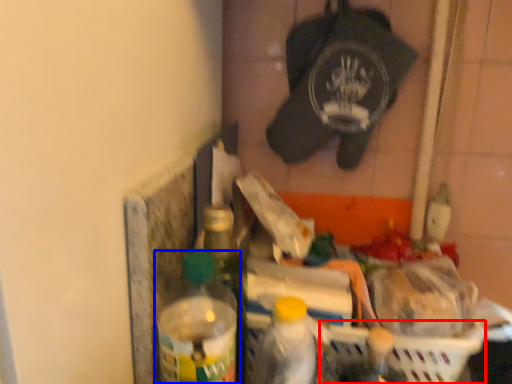
Question: Which point is further to the camera, basket (highlighted by a red box) or bottle (highlighted by a blue box)?

Choices:
 (A) basket
 (B) bottle

Answer: (A)